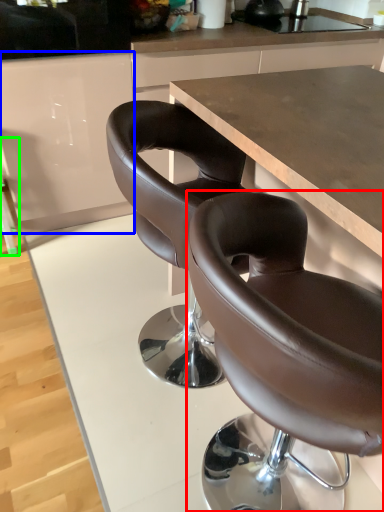
Question: Which object is positioned closest to chair (highlighted by a red box)? Select from cabinetry (highlighted by a blue box) and bar stool (highlighted by a green box).

Choices:
 (A) cabinetry
 (B) bar stool

Answer: (A)